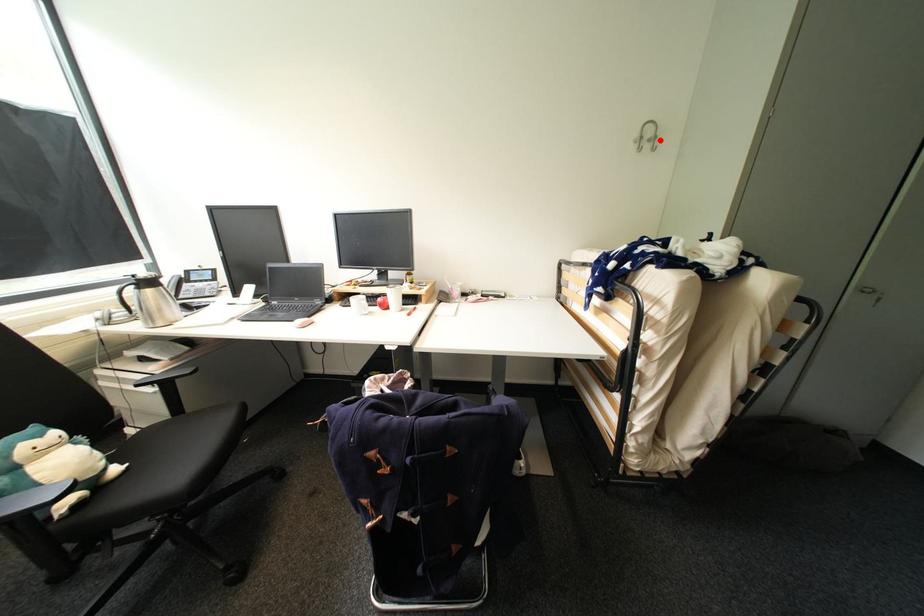
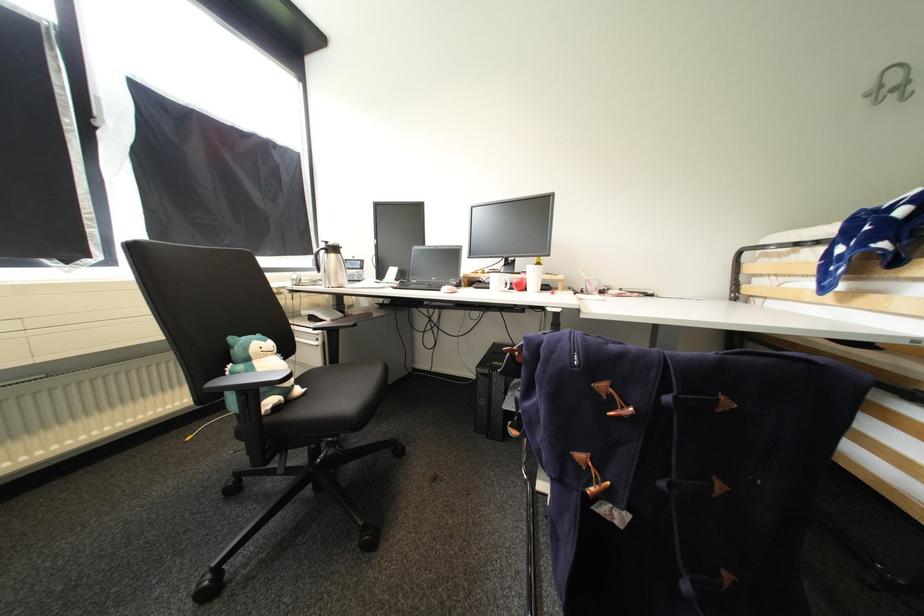
Find the pixel in the second image that matches the highlighted location in the first image.

(912, 84)